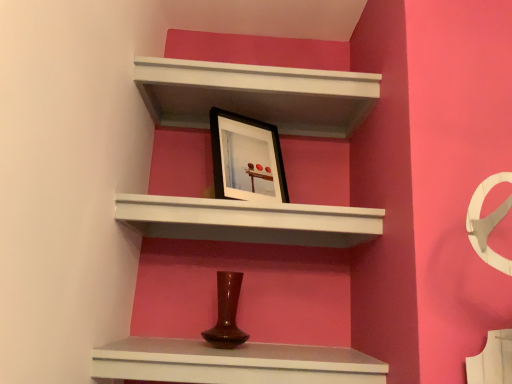
Question: From the image's perspective, is white matte shelf at upper center, arranged as the 2th shelf when viewed from the top, located beneath matte brown vase at center, which appears as the third shelf when viewed from the top?

Choices:
 (A) yes
 (B) no

Answer: (B)

Question: Considering the relative sizes of white matte shelf at upper center, arranged as the 2th shelf when viewed from the top, and matte brown vase at center, which appears as the third shelf when viewed from the top, in the image provided, is white matte shelf at upper center, arranged as the 2th shelf when viewed from the top, wider than matte brown vase at center, which appears as the third shelf when viewed from the top,?

Choices:
 (A) no
 (B) yes

Answer: (B)

Question: Considering the relative positions of white matte shelf at upper center, placed as the 2th shelf when sorted from bottom to top, and matte brown vase at center, which appears as the third shelf when viewed from the top, in the image provided, is white matte shelf at upper center, placed as the 2th shelf when sorted from bottom to top, behind matte brown vase at center, which appears as the third shelf when viewed from the top,?

Choices:
 (A) no
 (B) yes

Answer: (B)

Question: Considering the relative positions of white matte shelf at upper center, placed as the 2th shelf when sorted from bottom to top, and matte brown vase at center, arranged as the 1th shelf when ordered from the bottom, in the image provided, is white matte shelf at upper center, placed as the 2th shelf when sorted from bottom to top, to the left of matte brown vase at center, arranged as the 1th shelf when ordered from the bottom, from the viewer's perspective?

Choices:
 (A) no
 (B) yes

Answer: (A)

Question: Is white matte shelf at upper center, placed as the 2th shelf when sorted from bottom to top, in front of matte brown vase at center, which appears as the third shelf when viewed from the top?

Choices:
 (A) no
 (B) yes

Answer: (A)

Question: Is point tap(189, 349) closer or farther from the camera than point tap(216, 69)?

Choices:
 (A) farther
 (B) closer

Answer: (B)

Question: Is matte brown vase at center, arranged as the 1th shelf when ordered from the bottom, inside or outside of white matte shelf at upper center, the 3th shelf in the bottom-to-top sequence?

Choices:
 (A) inside
 (B) outside

Answer: (B)

Question: Considering the positions of matte brown vase at center, arranged as the 1th shelf when ordered from the bottom, and white matte shelf at upper center, positioned as the 1th shelf in top-to-bottom order, in the image, is matte brown vase at center, arranged as the 1th shelf when ordered from the bottom, bigger or smaller than white matte shelf at upper center, positioned as the 1th shelf in top-to-bottom order,?

Choices:
 (A) small
 (B) big

Answer: (B)

Question: Considering the positions of matte brown vase at center, which appears as the third shelf when viewed from the top, and white matte shelf at upper center, positioned as the 1th shelf in top-to-bottom order, in the image, is matte brown vase at center, which appears as the third shelf when viewed from the top, wider or thinner than white matte shelf at upper center, positioned as the 1th shelf in top-to-bottom order,?

Choices:
 (A) wide
 (B) thin

Answer: (B)

Question: In terms of size, does black matte picture frame at upper center appear bigger or smaller than matte brown vase at center, arranged as the 1th shelf when ordered from the bottom?

Choices:
 (A) small
 (B) big

Answer: (A)

Question: From the image's perspective, is black matte picture frame at upper center located above or below matte brown vase at center, which appears as the third shelf when viewed from the top?

Choices:
 (A) above
 (B) below

Answer: (A)

Question: Considering the positions of point (x=241, y=193) and point (x=211, y=362), is point (x=241, y=193) closer or farther from the camera than point (x=211, y=362)?

Choices:
 (A) farther
 (B) closer

Answer: (A)

Question: Considering their positions, is black matte picture frame at upper center located in front of or behind matte brown vase at center, which appears as the third shelf when viewed from the top?

Choices:
 (A) front
 (B) behind

Answer: (B)

Question: Is point (236, 221) closer or farther from the camera than point (252, 66)?

Choices:
 (A) farther
 (B) closer

Answer: (B)

Question: From the image's perspective, is white matte shelf at upper center, arranged as the 2th shelf when viewed from the top, located above or below white matte shelf at upper center, the 3th shelf in the bottom-to-top sequence?

Choices:
 (A) below
 (B) above

Answer: (A)